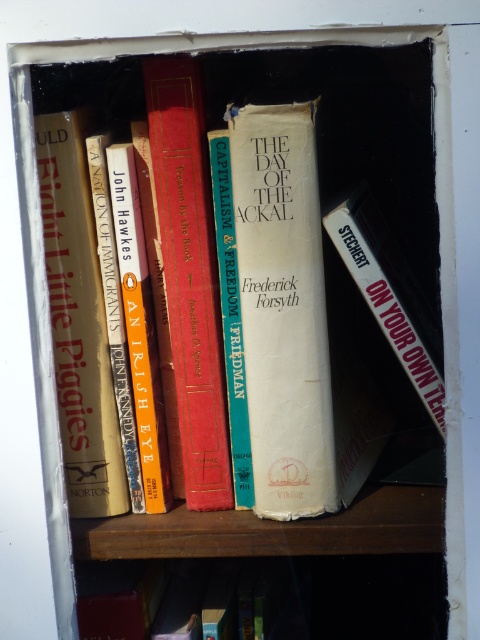
Question: Which object is positioned farthest from the white matte book at right?

Choices:
 (A) hardcover book at lower center
 (B) hardcover book at left
 (C) hardcover book at center

Answer: (A)

Question: Estimate the real-world distances between objects in this image. Which object is closer to the hardcover book at left?

Choices:
 (A) hardcover book at center
 (B) white matte book at right
 (C) hardcover book at lower center

Answer: (A)

Question: Which object appears farthest from the camera in this image?

Choices:
 (A) hardcover book at lower center
 (B) hardcover book at left
 (C) hardcover book at center

Answer: (A)

Question: Observing the image, what is the correct spatial positioning of hardcover book at center in reference to hardcover book at lower center?

Choices:
 (A) above
 (B) below

Answer: (A)

Question: Can you confirm if hardcover book at left is smaller than hardcover book at lower center?

Choices:
 (A) no
 (B) yes

Answer: (A)

Question: Is hardcover book at center positioned before hardcover book at left?

Choices:
 (A) no
 (B) yes

Answer: (A)